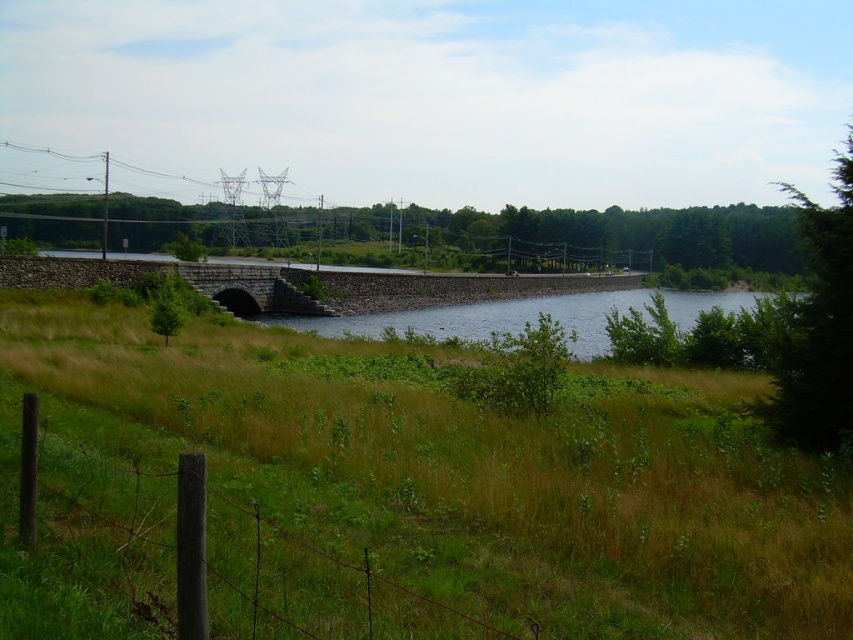
Question: Is green grassy at center bigger than blue concrete river at center?

Choices:
 (A) yes
 (B) no

Answer: (B)

Question: Among these points, which one is nearest to the camera?

Choices:
 (A) (405, 310)
 (B) (265, 280)

Answer: (B)

Question: Which point is farther to the camera?

Choices:
 (A) stone bridge at center
 (B) green grassy at center

Answer: (A)

Question: Does green grassy at center appear over stone bridge at center?

Choices:
 (A) no
 (B) yes

Answer: (A)

Question: Which point appears closest to the camera in this image?

Choices:
 (A) (456, 332)
 (B) (577, 518)
 (C) (247, 304)

Answer: (B)

Question: Is green grassy at center thinner than blue concrete river at center?

Choices:
 (A) no
 (B) yes

Answer: (B)